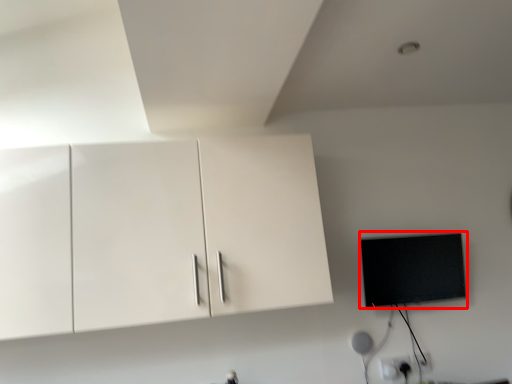
Question: From the image, what is the correct spatial relationship of flat (annotated by the red box) in relation to cabinetry?

Choices:
 (A) left
 (B) right

Answer: (B)